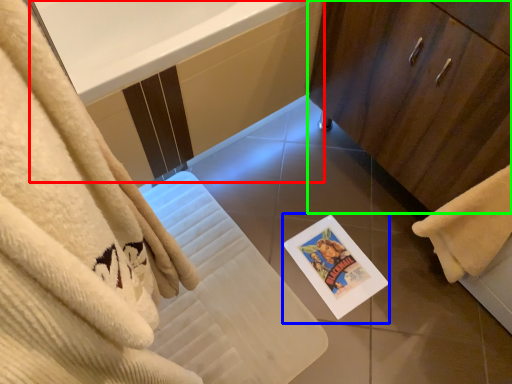
Question: Based on their relative distances, which object is farther from bath (highlighted by a red box)? Choose from postcard (highlighted by a blue box) and bathroom cabinet (highlighted by a green box).

Choices:
 (A) postcard
 (B) bathroom cabinet

Answer: (A)